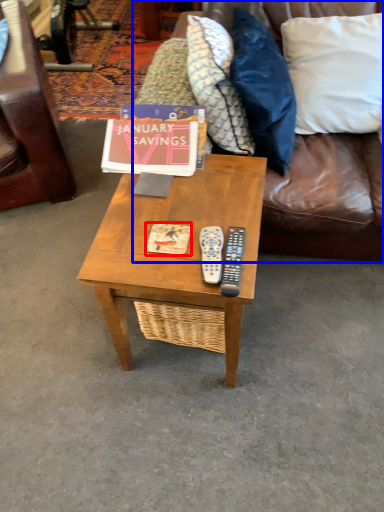
Question: Which object is further to the camera taking this photo, magazine (highlighted by a red box) or studio couch (highlighted by a blue box)?

Choices:
 (A) magazine
 (B) studio couch

Answer: (A)